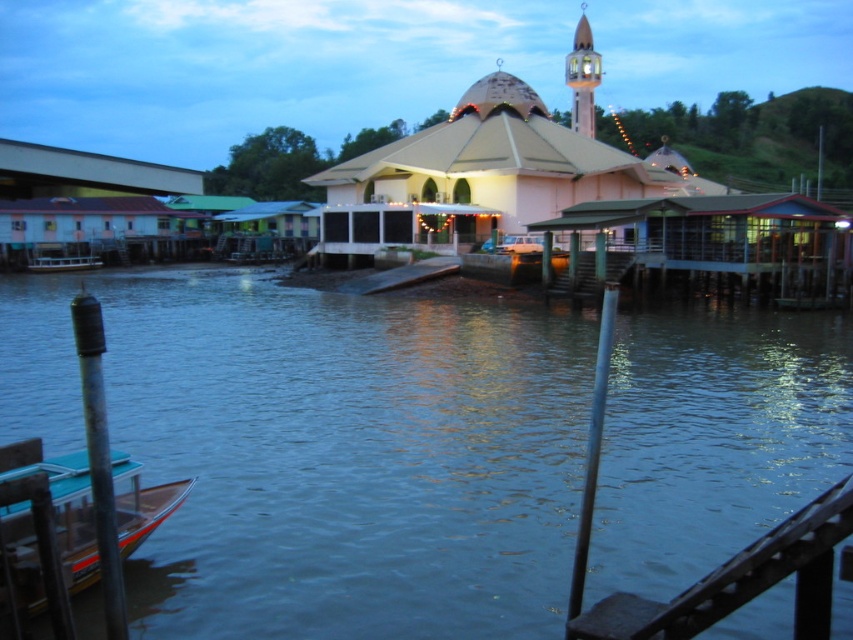
Question: Based on their relative distances, which object is farther from the white plastic boat at lower left?

Choices:
 (A) metallic pole at lower left
 (B) metallic pole at center

Answer: (B)

Question: Is wooden dock at right to the right of white plastic boat at lower left from the viewer's perspective?

Choices:
 (A) no
 (B) yes

Answer: (B)

Question: Which of the following is the farthest from the observer?

Choices:
 (A) (24, 509)
 (B) (590, 456)
 (C) (332, 408)

Answer: (C)

Question: Does clear water at center appear on the right side of metallic pole at center?

Choices:
 (A) yes
 (B) no

Answer: (B)

Question: Is metallic pole at lower left behind white plastic boat at lower left?

Choices:
 (A) no
 (B) yes

Answer: (A)

Question: Which object is the farthest from the white plastic boat at lower left?

Choices:
 (A) metallic pole at lower left
 (B) teal plastic boat at lower left

Answer: (B)